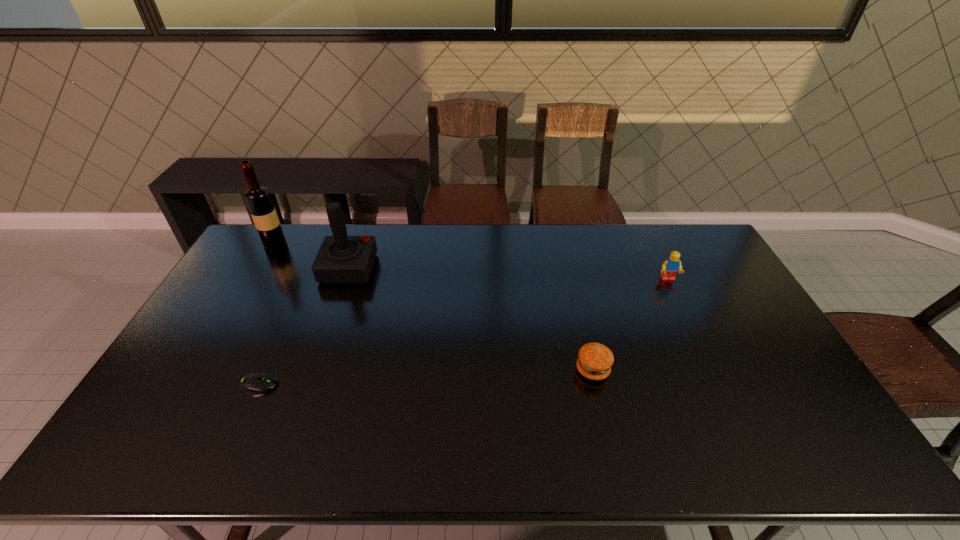
In the image, there is a desktop. Identify the location of vacant space at the right edge. (779, 357).

I want to click on free space at the far left corner of the desktop, so tap(259, 262).

Image resolution: width=960 pixels, height=540 pixels. In order to click on vacant region between the computer mouse and the fourth shortest object in this screenshot , I will do `click(303, 327)`.

Where is `free space that is in between the tallest object and the patty`? free space that is in between the tallest object and the patty is located at coordinates (434, 307).

Where is `free space between the rightmost object and the farthest object`? free space between the rightmost object and the farthest object is located at coordinates (471, 262).

Locate an element on the screen. This screenshot has height=540, width=960. free spot between the second tallest object and the computer mouse is located at coordinates (303, 327).

You are a GUI agent. You are given a task and a screenshot of the screen. Output one action in this format:
    pyautogui.click(x=<x>, y=<y>)
    Task: Click on the free spot between the third shortest object and the computer mouse
    The image size is (960, 540).
    Given the screenshot: What is the action you would take?
    [464, 332]

In order to click on vacant area that lies between the joystick and the rightmost object in this screenshot , I will do `click(508, 274)`.

Where is `free space between the rightmost object and the wine bottle`? free space between the rightmost object and the wine bottle is located at coordinates point(471,262).

In order to click on empty location between the Lego and the fourth tallest object in this screenshot , I will do `click(630, 325)`.